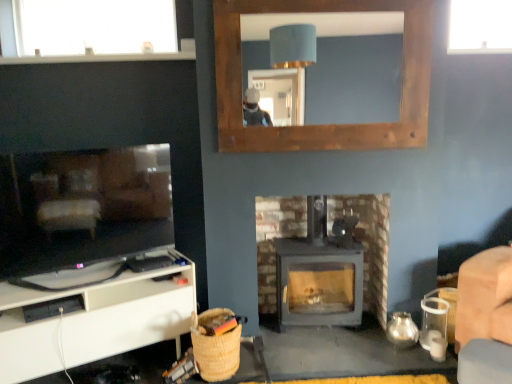
Question: Is transparent glass window at upper right, placed as the first window when sorted from right to left, positioned behind matte gray wood stove at center?

Choices:
 (A) yes
 (B) no

Answer: (A)

Question: Considering the relative sizes of transparent glass window at upper right, placed as the second window when sorted from left to right, and matte gray wood stove at center in the image provided, is transparent glass window at upper right, placed as the second window when sorted from left to right, shorter than matte gray wood stove at center?

Choices:
 (A) yes
 (B) no

Answer: (A)

Question: Can you confirm if transparent glass window at upper right, placed as the first window when sorted from right to left, is wider than matte gray wood stove at center?

Choices:
 (A) no
 (B) yes

Answer: (A)

Question: Can you confirm if transparent glass window at upper right, placed as the first window when sorted from right to left, is taller than matte gray wood stove at center?

Choices:
 (A) no
 (B) yes

Answer: (A)

Question: Does transparent glass window at upper right, placed as the first window when sorted from right to left, turn towards matte gray wood stove at center?

Choices:
 (A) no
 (B) yes

Answer: (A)

Question: From the image's perspective, does transparent glass window at upper right, placed as the first window when sorted from right to left, appear lower than matte gray wood stove at center?

Choices:
 (A) no
 (B) yes

Answer: (A)

Question: Can transparent glass window at upper left, arranged as the first window when viewed from the left, be found inside transparent glass window at upper right, placed as the first window when sorted from right to left?

Choices:
 (A) yes
 (B) no

Answer: (B)

Question: Is transparent glass window at upper right, placed as the second window when sorted from left to right, closer to camera compared to transparent glass window at upper left, the second window viewed from the right?

Choices:
 (A) yes
 (B) no

Answer: (B)

Question: Does transparent glass window at upper right, placed as the first window when sorted from right to left, turn towards transparent glass window at upper left, arranged as the first window when viewed from the left?

Choices:
 (A) no
 (B) yes

Answer: (A)

Question: From a real-world perspective, is transparent glass window at upper right, placed as the second window when sorted from left to right, positioned over transparent glass window at upper left, arranged as the first window when viewed from the left, based on gravity?

Choices:
 (A) no
 (B) yes

Answer: (A)

Question: Does transparent glass window at upper right, placed as the second window when sorted from left to right, appear on the right side of transparent glass window at upper left, arranged as the first window when viewed from the left?

Choices:
 (A) yes
 (B) no

Answer: (A)

Question: Is transparent glass window at upper right, placed as the first window when sorted from right to left, outside of transparent glass window at upper left, the second window viewed from the right?

Choices:
 (A) no
 (B) yes

Answer: (B)

Question: Is white matte cabinet at lower left completely or partially inside transparent glass window at upper right, placed as the second window when sorted from left to right?

Choices:
 (A) yes
 (B) no

Answer: (B)